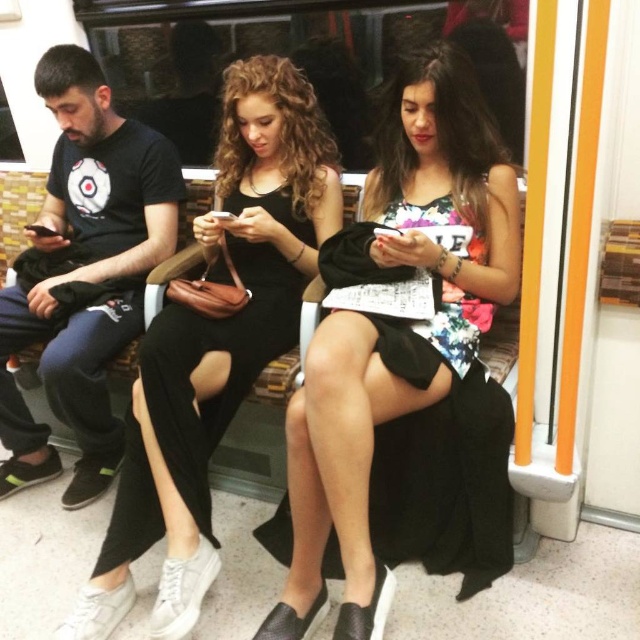
You are a passenger in the subway car and you want to know which dress is bigger between the floral printed dress at center and the black matte dress at center. Which one is bigger?

The floral printed dress at center is larger in size than the black matte dress at center.